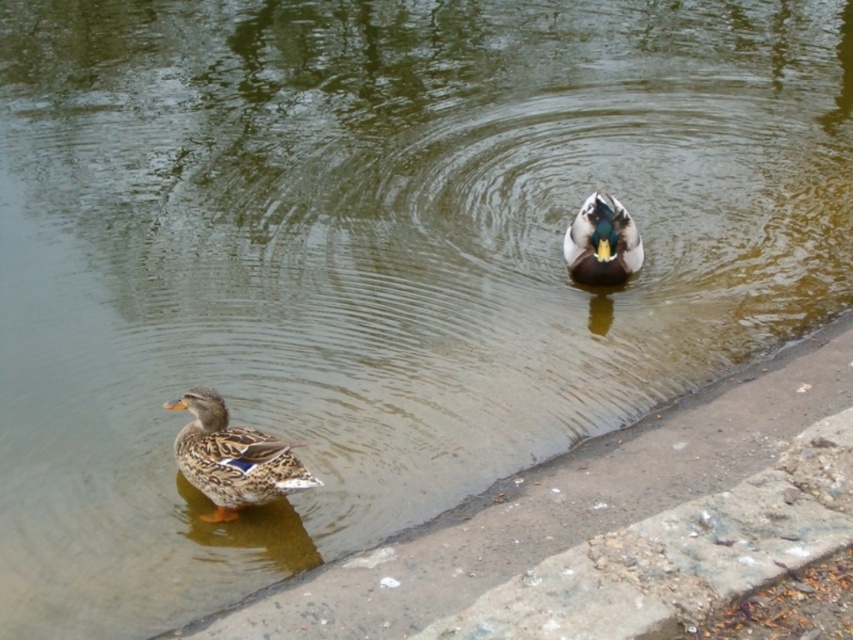
Based on the photo, does brown speckled feathers duck at lower left come behind shiny green duck at center?

No, brown speckled feathers duck at lower left is closer to the viewer.

The width and height of the screenshot is (853, 640). What do you see at coordinates (231, 458) in the screenshot?
I see `brown speckled feathers duck at lower left` at bounding box center [231, 458].

Is point (260, 458) positioned after point (625, 257)?

No.

Identify the location of brown speckled feathers duck at lower left. The width and height of the screenshot is (853, 640). (231, 458).